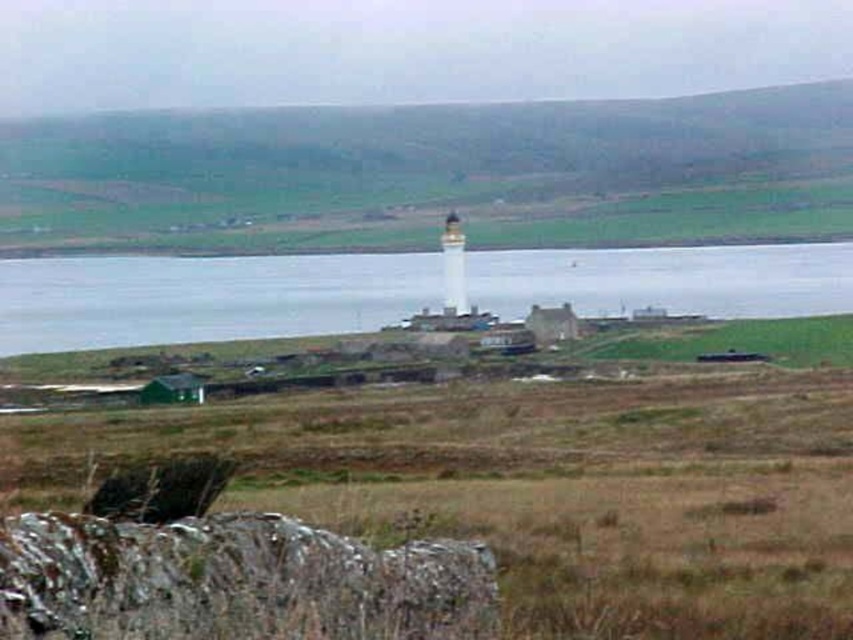
In the scene shown: Based on the scene description, where is the clear water at center located in terms of its 2D coordinates?

The clear water at center is located at the 2D coordinates of point (204, 298).

Looking at this image, you are standing at the point labeled as point (618, 296) in the image. You want to walk to the lighthouse. Which direction should you head to reach the lighthouse?

Since the lighthouse is the most prominent structure in the scene and the point is located in the foreground, you should head towards the lighthouse by moving towards the center of the image where the lighthouse stands.